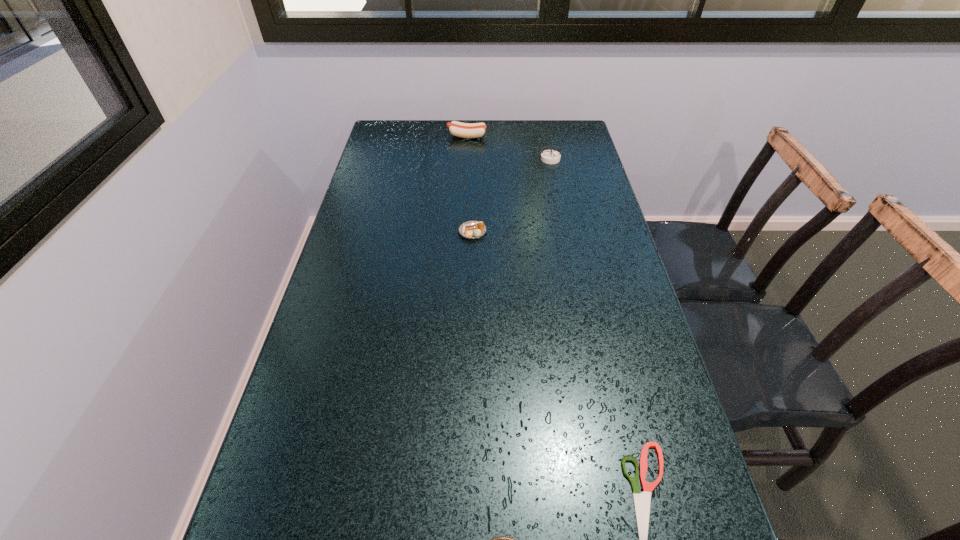
The image size is (960, 540). In order to click on sausage in this screenshot , I will do `click(464, 130)`.

At what (x,y) coordinates should I click in order to perform the action: click on the farther compass. Please return your answer as a coordinate pair (x, y). Image resolution: width=960 pixels, height=540 pixels. Looking at the image, I should click on (550, 156).

You are a GUI agent. You are given a task and a screenshot of the screen. Output one action in this format:
    pyautogui.click(x=<x>, y=<y>)
    Task: Click on the fourth nearest object
    
    Given the screenshot: What is the action you would take?
    pyautogui.click(x=550, y=156)

This screenshot has width=960, height=540. I want to click on the third nearest object, so click(x=472, y=229).

This screenshot has height=540, width=960. Identify the location of pastry. (472, 229).

Find the location of a particular element. The height and width of the screenshot is (540, 960). free location located on the front of the farthest object is located at coordinates (465, 194).

Where is `blank space located on the front of the taller compass`? The height and width of the screenshot is (540, 960). blank space located on the front of the taller compass is located at coordinates (554, 178).

The width and height of the screenshot is (960, 540). Identify the location of vacant region located on the front of the third nearest object. (471, 286).

At what (x,y) coordinates should I click in order to perform the action: click on object at the far edge. Please return your answer as a coordinate pair (x, y). This screenshot has height=540, width=960. Looking at the image, I should click on (464, 130).

At what (x,y) coordinates should I click in order to perform the action: click on object located in the right edge section of the desktop. Please return your answer as a coordinate pair (x, y). Looking at the image, I should click on (550, 156).